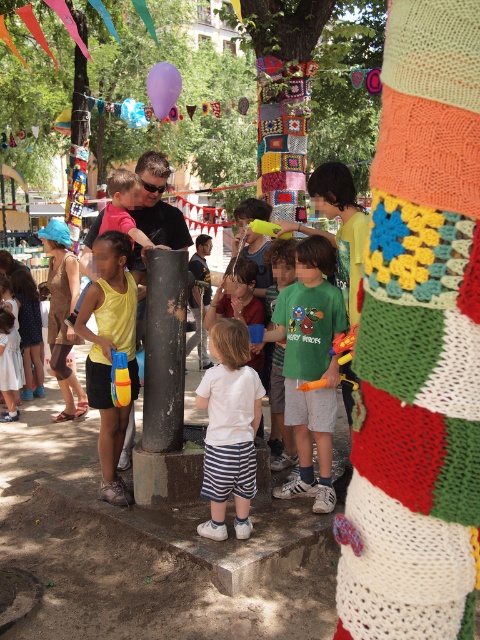
In the scene shown: Is white cotton shirt at center bigger than yellow matte tank top at left?

No.

Does point (250, 417) lie in front of point (117, 289)?

Yes, it is in front of point (117, 289).

Find the location of a particular element. Image resolution: width=480 pixels, height=640 pixels. white cotton shirt at center is located at coordinates (228, 428).

Does point (325, 433) come closer to viewer compared to point (153, 76)?

Yes, point (325, 433) is in front of point (153, 76).

Between green matte shirt at center and purple fabric balloon at upper center, which one is positioned lower?

green matte shirt at center

Between point (345, 314) and point (148, 84), which one is positioned in front?

Point (345, 314)

Find the location of a particular element. Image resolution: width=480 pixels, height=640 pixels. green matte shirt at center is located at coordinates (310, 365).

Which is below, green matte shirt at center or yellow matte tank top at left?

green matte shirt at center is lower down.

In the scene shown: Which of these two, green matte shirt at center or yellow matte tank top at left, stands shorter?

green matte shirt at center

Between point (289, 410) and point (134, 304), which one is positioned behind?

Point (289, 410)

The image size is (480, 640). What are the coordinates of `green matte shirt at center` in the screenshot? It's located at (310, 365).